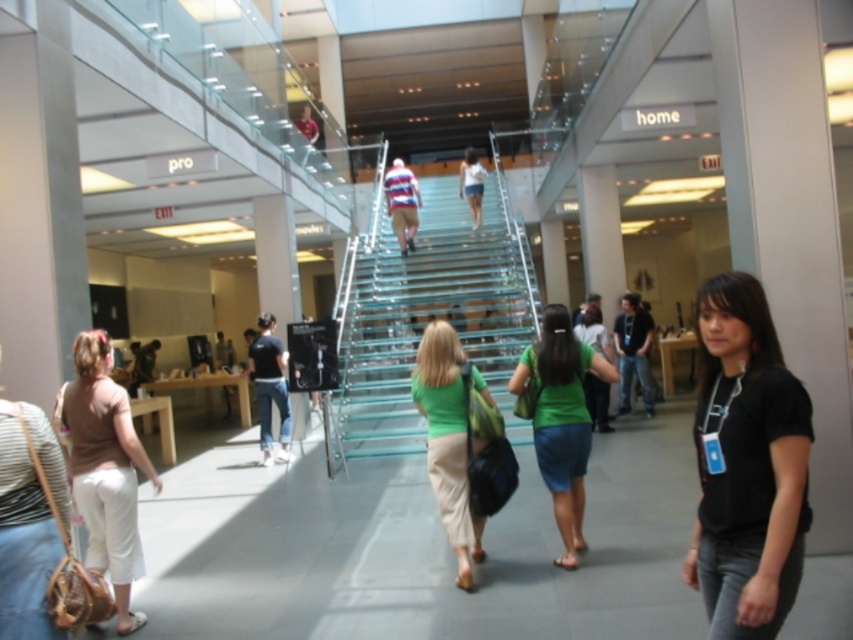
You are a customer in the store and want to choose between two green shirts displayed at the center. The shirts are labeled as green matte shirt at center and green fabric shirt at center. Which one is wider?

The green matte shirt at center is wider than the green fabric shirt at center.

You are a customer in the store and want to pick up the matte brown purse at lower left and the green fabric shirt at center. Which item should you approach first to reach the one closer to you?

You should approach the matte brown purse at lower left first because it is closer to you than the green fabric shirt at center.